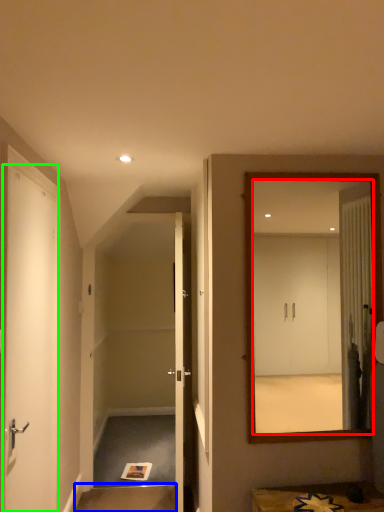
Question: Which object is positioned closest to mirror (highlighted by a red box)? Select from stair (highlighted by a blue box) and door (highlighted by a green box).

Choices:
 (A) stair
 (B) door

Answer: (B)